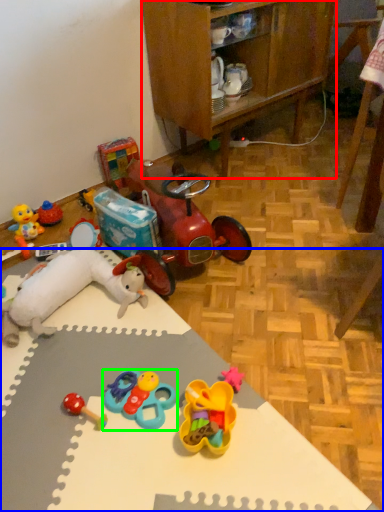
Question: Considering the real-world distances, which object is closest to cabinetry (highlighted by a red box)? desk (highlighted by a blue box) or toy (highlighted by a green box).

Choices:
 (A) desk
 (B) toy

Answer: (A)